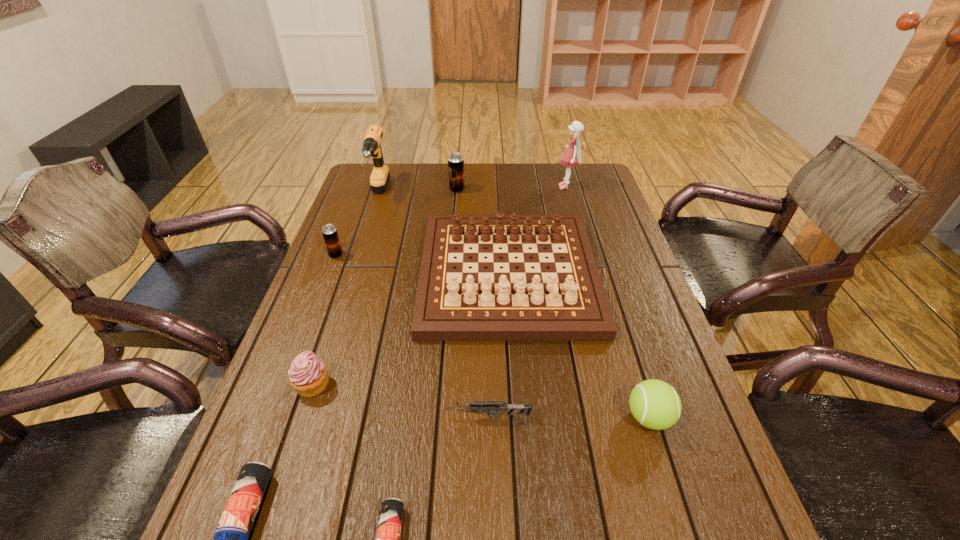
Locate which beer can is the closest to the smaller blue beer can. Please provide its 2D coordinates. Your answer should be formatted as a tuple, i.e. [(x, y)], where the tuple contains the x and y coordinates of a point satisfying the conditions above.

[(230, 539)]

Identify which beer can is located as the nearest to the cupcake. Please provide its 2D coordinates. Your answer should be formatted as a tuple, i.e. [(x, y)], where the tuple contains the x and y coordinates of a point satisfying the conditions above.

[(230, 539)]

Find the location of a particular element. The width and height of the screenshot is (960, 540). free space that satisfies the following two spatial constraints: 1. on the front-facing side of the green tennis ball; 2. on the left side of the pink doll is located at coordinates (632, 417).

The width and height of the screenshot is (960, 540). Identify the location of vacant area in the image that satisfies the following two spatial constraints: 1. on the front-facing side of the doll; 2. on the side with the white pieces of the gameboard. (591, 274).